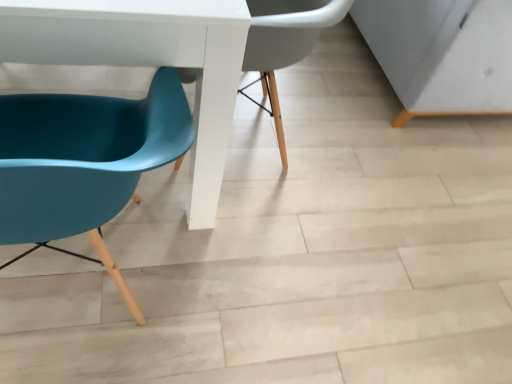
Locate an element on the screen. The image size is (512, 384). free space below teal plastic chair at left, the second chair from the top (from a real-world perspective) is located at coordinates (87, 293).